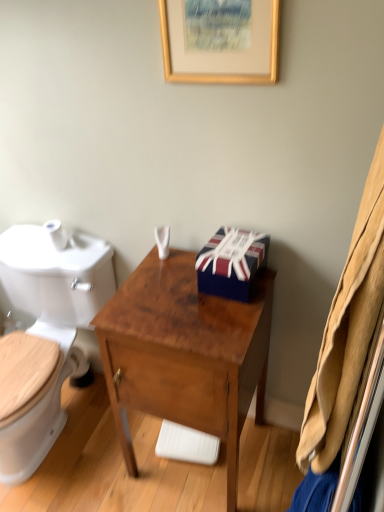
Question: From the image's perspective, would you say white glossy toilet at left is positioned over white matte toilet paper at left?

Choices:
 (A) yes
 (B) no

Answer: (B)

Question: Considering the relative sizes of white glossy toilet at left and white matte toilet paper at left in the image provided, is white glossy toilet at left thinner than white matte toilet paper at left?

Choices:
 (A) yes
 (B) no

Answer: (B)

Question: Considering the relative positions of white glossy toilet at left and white matte toilet paper at left in the image provided, is white glossy toilet at left to the left of white matte toilet paper at left from the viewer's perspective?

Choices:
 (A) no
 (B) yes

Answer: (B)

Question: Can you confirm if white glossy toilet at left is positioned to the right of white matte toilet paper at left?

Choices:
 (A) no
 (B) yes

Answer: (A)

Question: Is white glossy toilet at left in front of white matte toilet paper at left?

Choices:
 (A) no
 (B) yes

Answer: (B)

Question: Considering the positions of white glossy toilet at left and white matte toilet paper at left in the image, is white glossy toilet at left bigger or smaller than white matte toilet paper at left?

Choices:
 (A) small
 (B) big

Answer: (B)

Question: Based on their positions, is white glossy toilet at left located to the left or right of white matte toilet paper at left?

Choices:
 (A) left
 (B) right

Answer: (A)

Question: Considering the positions of point (29, 464) and point (62, 248), is point (29, 464) closer or farther from the camera than point (62, 248)?

Choices:
 (A) closer
 (B) farther

Answer: (B)

Question: From the image's perspective, is white glossy toilet at left above or below white matte toilet paper at left?

Choices:
 (A) below
 (B) above

Answer: (A)

Question: From the image's perspective, is brown wood desk at center above or below white matte toilet paper at left?

Choices:
 (A) below
 (B) above

Answer: (A)

Question: Considering the positions of point (190, 419) and point (59, 242), is point (190, 419) closer or farther from the camera than point (59, 242)?

Choices:
 (A) farther
 (B) closer

Answer: (B)

Question: Is brown wood desk at center to the left or to the right of white matte toilet paper at left in the image?

Choices:
 (A) right
 (B) left

Answer: (A)

Question: Looking at the image, does brown wood desk at center seem bigger or smaller compared to white matte toilet paper at left?

Choices:
 (A) big
 (B) small

Answer: (A)

Question: From the image's perspective, is brown wood desk at center positioned above or below gold wooden picture frame at upper center?

Choices:
 (A) above
 (B) below

Answer: (B)

Question: Looking at their shapes, would you say brown wood desk at center is wider or thinner than gold wooden picture frame at upper center?

Choices:
 (A) thin
 (B) wide

Answer: (B)